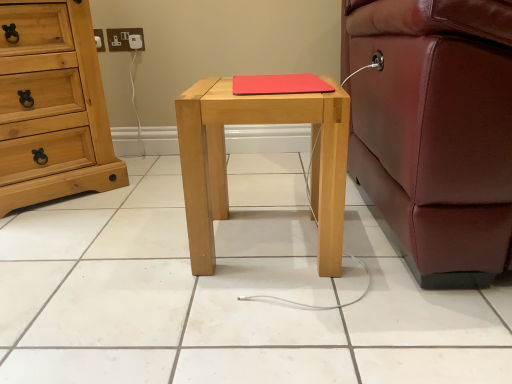
Question: Is white plastic socket at upper left with light brown wooden chest of drawers at left?

Choices:
 (A) yes
 (B) no

Answer: (B)

Question: Can you confirm if white plastic socket at upper left is taller than light brown wooden chest of drawers at left?

Choices:
 (A) yes
 (B) no

Answer: (B)

Question: Is white plastic socket at upper left shorter than light brown wooden chest of drawers at left?

Choices:
 (A) no
 (B) yes

Answer: (B)

Question: Is light brown wooden chest of drawers at left completely or partially inside white plastic socket at upper left?

Choices:
 (A) no
 (B) yes

Answer: (A)

Question: Does white plastic socket at upper left appear on the right side of light brown wooden chest of drawers at left?

Choices:
 (A) yes
 (B) no

Answer: (A)

Question: Is white plastic socket at upper left positioned far away from light brown wooden chest of drawers at left?

Choices:
 (A) no
 (B) yes

Answer: (A)

Question: Is light brown wooden chest of drawers at left far from white plastic socket at upper left?

Choices:
 (A) yes
 (B) no

Answer: (B)

Question: Is light brown wooden chest of drawers at left facing away from white plastic socket at upper left?

Choices:
 (A) no
 (B) yes

Answer: (A)

Question: Could you tell me if light brown wooden chest of drawers at left is turned towards white plastic socket at upper left?

Choices:
 (A) no
 (B) yes

Answer: (A)

Question: Would you say light brown wooden chest of drawers at left is outside white plastic socket at upper left?

Choices:
 (A) no
 (B) yes

Answer: (B)

Question: From the image's perspective, is light brown wooden chest of drawers at left located above white plastic socket at upper left?

Choices:
 (A) yes
 (B) no

Answer: (B)

Question: Is light brown wooden chest of drawers at left taller than white plastic socket at upper left?

Choices:
 (A) yes
 (B) no

Answer: (A)

Question: Does light brown wooden chest of drawers at left have a greater width compared to red matte mousepad at center?

Choices:
 (A) yes
 (B) no

Answer: (A)